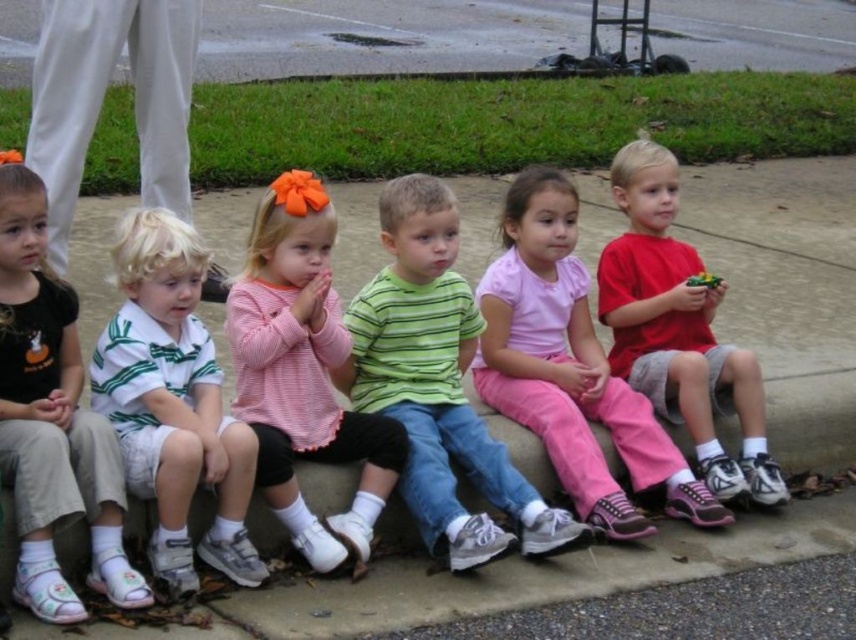
Question: Does pink fabric shirt at center appear on the left side of white striped polo shirt at left?

Choices:
 (A) no
 (B) yes

Answer: (A)

Question: Which object is positioned closest to the white striped polo shirt at center?

Choices:
 (A) pink fabric shirt at center
 (B) pink cotton pants at center

Answer: (A)

Question: Does pink fabric shirt at center have a lesser width compared to white striped polo shirt at left?

Choices:
 (A) no
 (B) yes

Answer: (A)

Question: Which point is farther to the camera?

Choices:
 (A) (498, 280)
 (B) (369, 552)

Answer: (A)

Question: Does green striped shirt at center have a lesser width compared to pink cotton pants at center?

Choices:
 (A) no
 (B) yes

Answer: (B)

Question: Estimate the real-world distances between objects in this image. Which object is farther from the pink fabric shirt at center?

Choices:
 (A) white striped polo shirt at left
 (B) green striped shirt at center
 (C) pink cotton pants at center

Answer: (C)